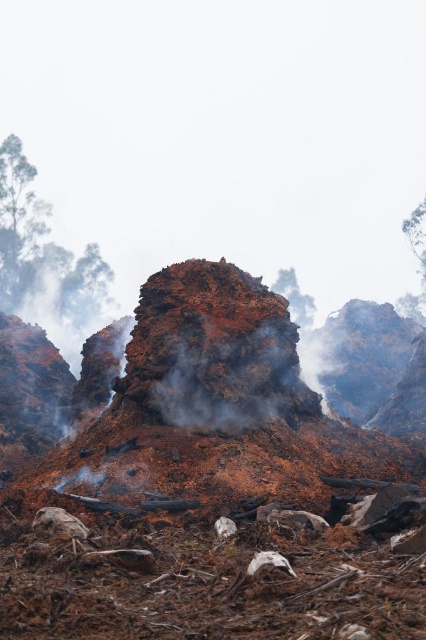
Question: Which of the following is the closest to the observer?

Choices:
 (A) (261, 394)
 (B) (54, 324)

Answer: (A)

Question: Which object is farther from the camera taking this photo?

Choices:
 (A) rusty metallic rock at center
 (B) green leafy tree at left

Answer: (B)

Question: Can you confirm if rusty metallic rock at center is positioned above green leafy tree at left?

Choices:
 (A) yes
 (B) no

Answer: (B)

Question: Is rusty metallic rock at center closer to the viewer compared to green leafy tree at left?

Choices:
 (A) yes
 (B) no

Answer: (A)

Question: Does rusty metallic rock at center appear under green leafy tree at left?

Choices:
 (A) yes
 (B) no

Answer: (A)

Question: Which object appears closest to the camera in this image?

Choices:
 (A) rusty metallic rock at center
 (B) green leafy tree at left

Answer: (A)